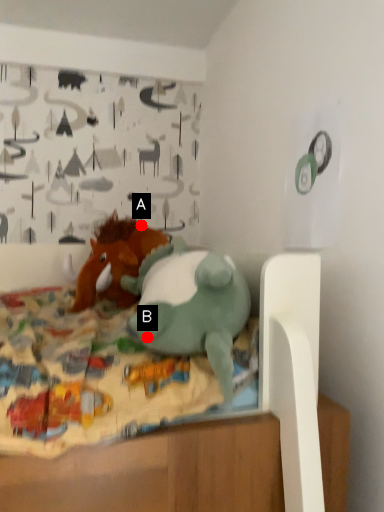
Question: Two points are circled on the image, labeled by A and B beside each circle. Which of the following is the closest to the observer?

Choices:
 (A) A is closer
 (B) B is closer

Answer: (B)